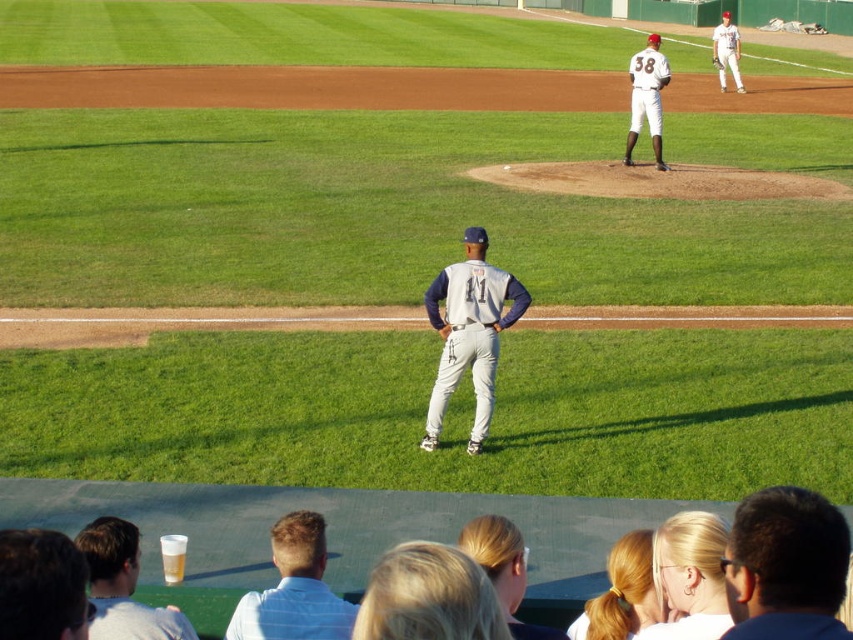
What is the position of the dark brown hair at center in the image?

The dark brown hair at center is located at point coordinates of (786, 566).

You are a photographer standing at the edge of the baseball field. You want to take a photo of the gray fabric baseball uniform at center. If your camera has a maximum focus range of 10 meters, will you be able to capture the uniform clearly?

The gray fabric baseball uniform at center is 10.63 meters away from the viewer. Since the camera can only focus up to 10 meters, it will not be able to capture the uniform clearly.